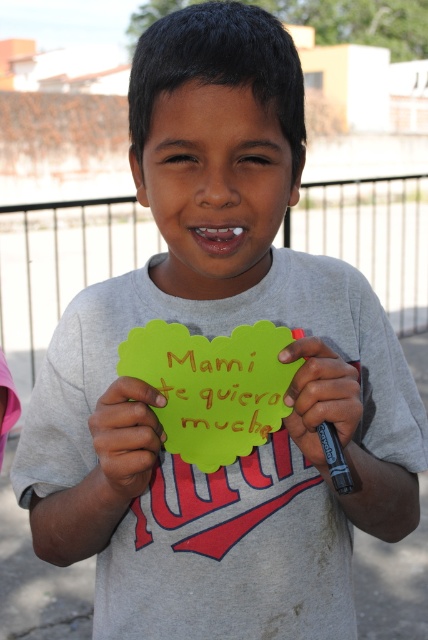
You are a photographer who wants to capture the smooth yellow paper at center in the image. Based on the scene description, where should you focus your camera to ensure it is centered in the frame?

You should focus your camera at point coordinates of [124,442] to center the smooth yellow paper at center in the frame.

Based on the scene described, can you determine which object, the smooth yellow paper at center or the matte green paper at center, is wider?

The smooth yellow paper at center might be wider than matte green paper at center.

The scene shows a boy holding a handmade card. The card has two layers made of different colored papers. The top layer is yellow paper at center, and the bottom layer is matte green paper at center. Which color paper is visible on top of the card?

The yellow paper at center is above the matte green paper at center, so the yellow paper is visible on top of the card.